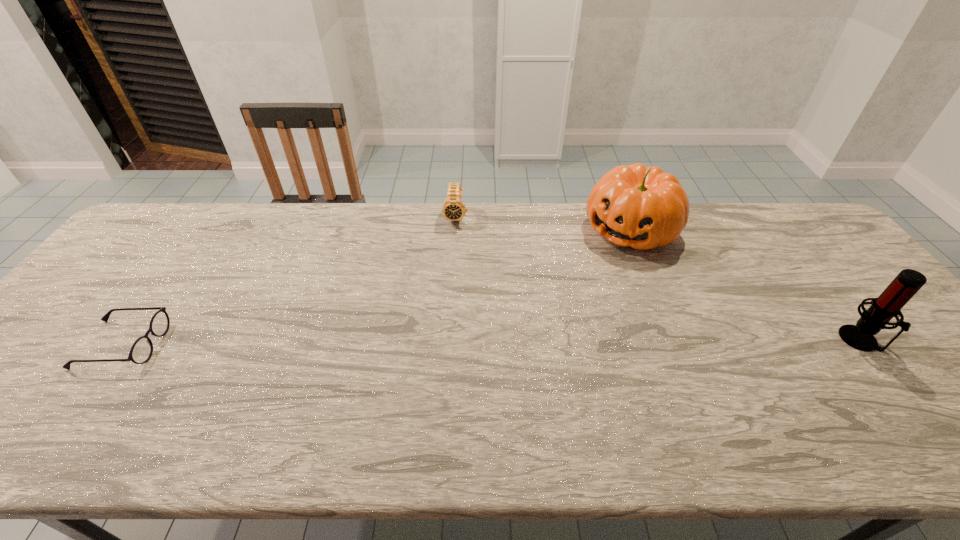
In order to click on free spot located on the carved face of the second object from right to left in this screenshot , I will do `click(589, 283)`.

Where is `vacant space situated on the face of the second object from left to right`? vacant space situated on the face of the second object from left to right is located at coordinates (448, 298).

Image resolution: width=960 pixels, height=540 pixels. In order to click on vacant space located 0.160m on the face of the second object from left to right in this screenshot , I will do `click(452, 261)`.

At what (x,y) coordinates should I click in order to perform the action: click on vacant space situated on the face of the second object from left to right. Please return your answer as a coordinate pair (x, y). The width and height of the screenshot is (960, 540). Looking at the image, I should click on [448, 301].

This screenshot has width=960, height=540. In order to click on pumpkin that is positioned at the far edge in this screenshot , I will do 644,208.

At what (x,y) coordinates should I click in order to perform the action: click on watch present at the far edge. Please return your answer as a coordinate pair (x, y). Looking at the image, I should click on (453, 209).

At what (x,y) coordinates should I click in order to perform the action: click on object that is at the left edge. Please return your answer as a coordinate pair (x, y). The image size is (960, 540). Looking at the image, I should click on (141, 351).

Identify the location of object that is at the right edge. The height and width of the screenshot is (540, 960). (908, 282).

Image resolution: width=960 pixels, height=540 pixels. I want to click on vacant area at the far edge of the desktop, so [x=399, y=220].

In the image, there is a desktop. Where is `free region at the near edge`? This screenshot has height=540, width=960. free region at the near edge is located at coordinates (723, 386).